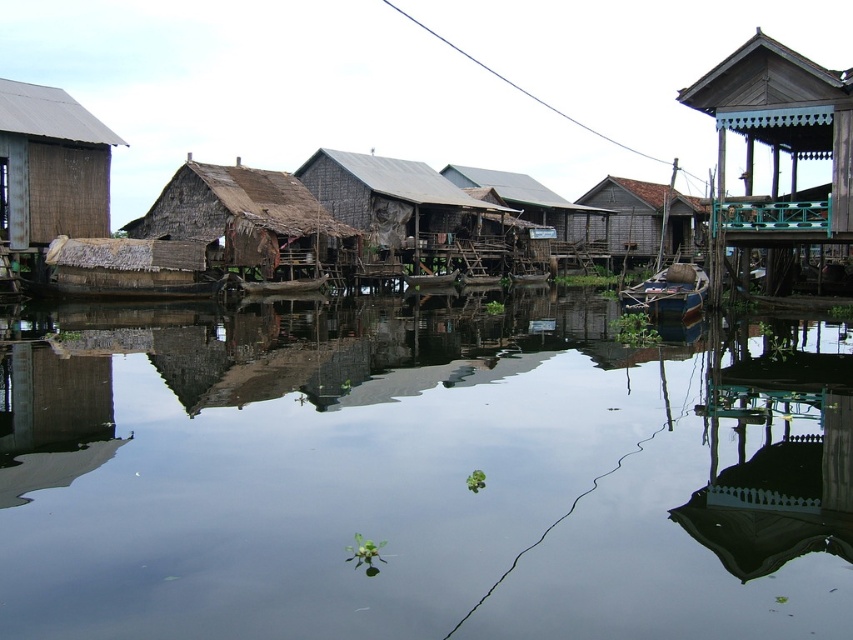
Does transparent water at center have a greater height compared to wooden hut at center?

Incorrect, transparent water at center's height is not larger of wooden hut at center's.

Can you confirm if transparent water at center is smaller than wooden hut at center?

Yes.

I want to click on transparent water at center, so click(x=419, y=474).

Image resolution: width=853 pixels, height=640 pixels. What are the coordinates of `transparent water at center` in the screenshot? It's located at (419, 474).

Does transparent water at center lie behind dark brown wooden hut at center?

No, it is not.

Is transparent water at center closer to camera compared to dark brown wooden hut at center?

Yes.

Identify the location of transparent water at center. The width and height of the screenshot is (853, 640). (419, 474).

Can you confirm if rustic wooden houses at center is bigger than dark brown wooden hut at center?

Yes.

Does rustic wooden houses at center appear on the left side of dark brown wooden hut at center?

Incorrect, rustic wooden houses at center is not on the left side of dark brown wooden hut at center.

Does point (722, 134) come in front of point (427, 192)?

Yes, point (722, 134) is closer to viewer.

At what (x,y) coordinates should I click in order to perform the action: click on rustic wooden houses at center. Please return your answer as a coordinate pair (x, y). Looking at the image, I should click on (347, 132).